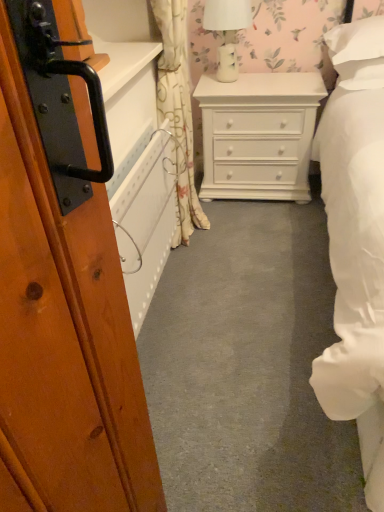
Question: Is the depth of floral fabric curtain at center greater than that of white painted wood chest of drawers at center?

Choices:
 (A) no
 (B) yes

Answer: (A)

Question: From the image's perspective, is floral fabric curtain at center beneath white painted wood chest of drawers at center?

Choices:
 (A) no
 (B) yes

Answer: (B)

Question: Is floral fabric curtain at center oriented away from white painted wood chest of drawers at center?

Choices:
 (A) no
 (B) yes

Answer: (A)

Question: Does floral fabric curtain at center have a lesser height compared to white painted wood chest of drawers at center?

Choices:
 (A) no
 (B) yes

Answer: (A)

Question: Can you confirm if floral fabric curtain at center is bigger than white painted wood chest of drawers at center?

Choices:
 (A) yes
 (B) no

Answer: (B)

Question: Does floral fabric curtain at center have a lesser width compared to white painted wood chest of drawers at center?

Choices:
 (A) yes
 (B) no

Answer: (A)

Question: From a real-world perspective, is white glossy table lamp at upper center on top of floral fabric curtain at center?

Choices:
 (A) no
 (B) yes

Answer: (B)

Question: Considering the relative positions of white glossy table lamp at upper center and floral fabric curtain at center in the image provided, is white glossy table lamp at upper center behind floral fabric curtain at center?

Choices:
 (A) no
 (B) yes

Answer: (B)

Question: From the image's perspective, would you say white glossy table lamp at upper center is shown under floral fabric curtain at center?

Choices:
 (A) yes
 (B) no

Answer: (B)

Question: Is the position of white glossy table lamp at upper center less distant than that of floral fabric curtain at center?

Choices:
 (A) no
 (B) yes

Answer: (A)

Question: Is floral fabric curtain at center a part of white glossy table lamp at upper center?

Choices:
 (A) yes
 (B) no

Answer: (B)

Question: Can you confirm if white glossy table lamp at upper center is bigger than floral fabric curtain at center?

Choices:
 (A) no
 (B) yes

Answer: (A)

Question: From the image's perspective, is floral fabric curtain at center under white glossy table lamp at upper center?

Choices:
 (A) yes
 (B) no

Answer: (A)